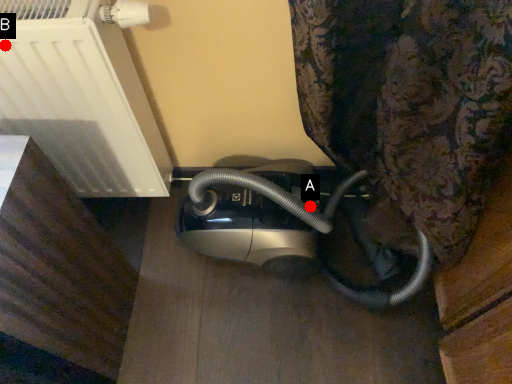
Question: Two points are circled on the image, labeled by A and B beside each circle. Which of the following is the closest to the observer?

Choices:
 (A) A is closer
 (B) B is closer

Answer: (B)